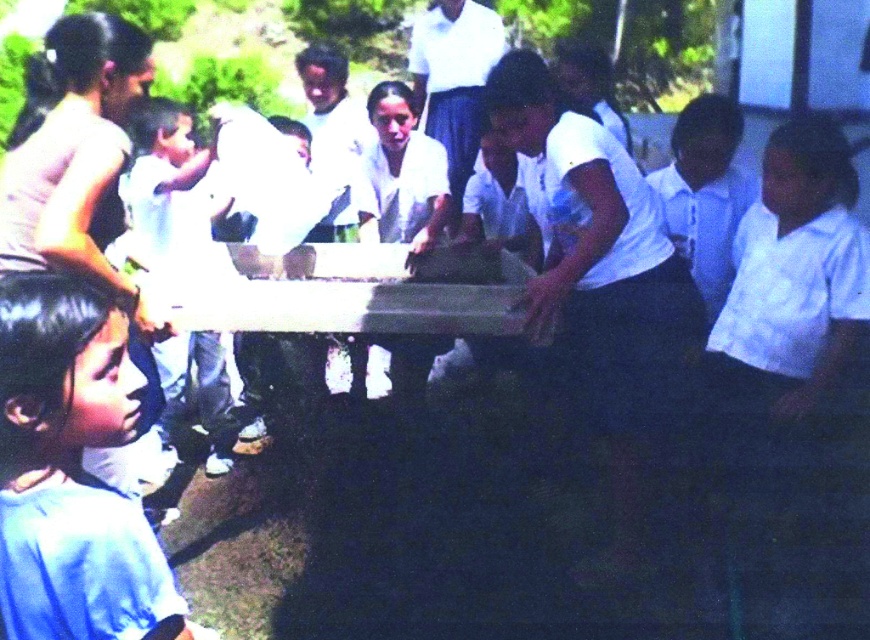
You are a photographer standing at the center of the scene. You want to take a photo that includes both the white cotton shirt at lower right and the blue fabric shirt at lower left. Given that your camera has a maximum angle of view of 60 degrees, will you be able to capture both shirts in a single frame?

The white cotton shirt at lower right is 7.71 feet from the blue fabric shirt at lower left. To determine if they can fit within a 60 degree angle, we need to calculate the distance from the photographer to the shirts. However, without knowing the distance between the photographer and the shirts, we can only state their separation but cannot confirm if the angle requirement is met. Thus, it is uncertain if both can be captured in one frame with the given information.

You are standing 3 meters away from the table where the children are gathered. Can you reach the point at coordinates point (x=862, y=262) without moving closer?

The distance of point (x=862, y=262) from viewer is 2.98 meters, so yes, you can reach the point at point (x=862, y=262) without moving closer since it is within your 3 meters range.

You are a photographer trying to capture a closeup of the point at location point (18,452) while also including the point at point (850,268) in the frame. Given their positions, which point should you focus on to ensure both are in focus?

You should focus on point (850,268) because it is farther from the camera than point (18,452). By focusing on the farther point, the closer point will still be within the depth of field, ensuring both are in focus.